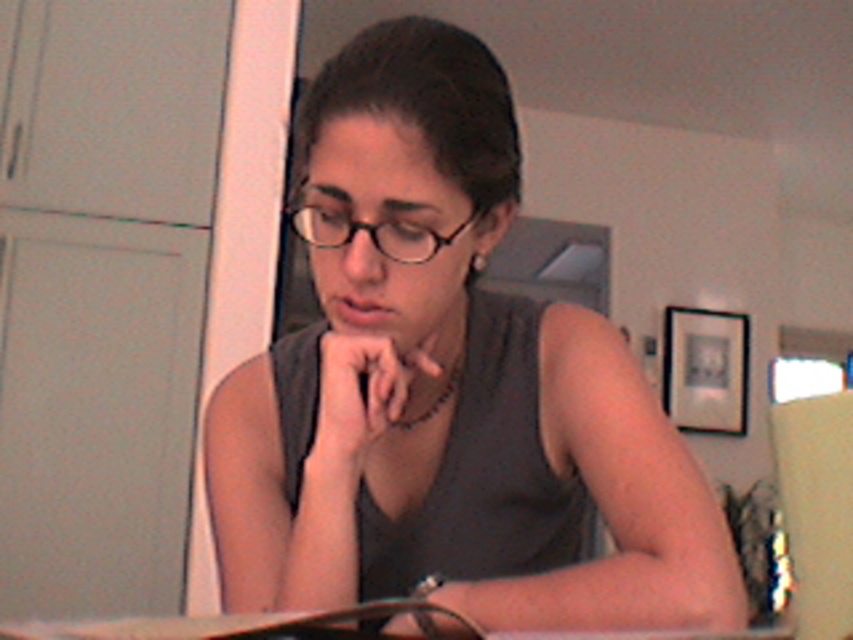
Question: Can you confirm if matte gray tank top at center is thinner than black plastic glasses at center?

Choices:
 (A) yes
 (B) no

Answer: (B)

Question: Where is matte gray tank top at center located in relation to black plastic glasses at center in the image?

Choices:
 (A) left
 (B) right

Answer: (B)

Question: Which of the following is the farthest from the observer?

Choices:
 (A) (456, 244)
 (B) (393, 248)

Answer: (A)

Question: Observing the image, what is the correct spatial positioning of matte gray tank top at center in reference to black plastic glasses at center?

Choices:
 (A) left
 (B) right

Answer: (B)